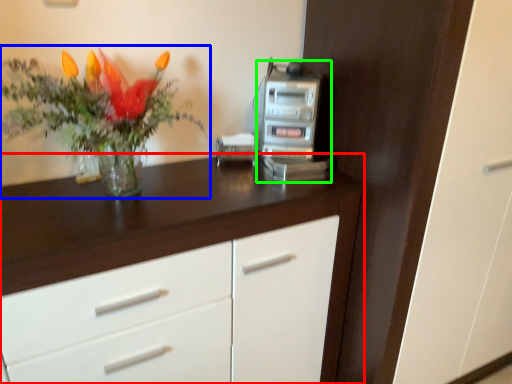
Question: Considering the real-world distances, which object is farthest from chest of drawers (highlighted by a red box)? houseplant (highlighted by a blue box) or appliance (highlighted by a green box)?

Choices:
 (A) houseplant
 (B) appliance

Answer: (B)